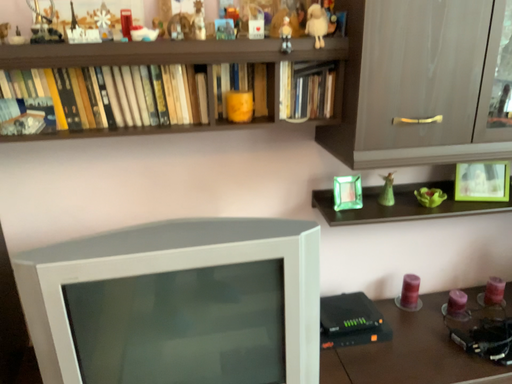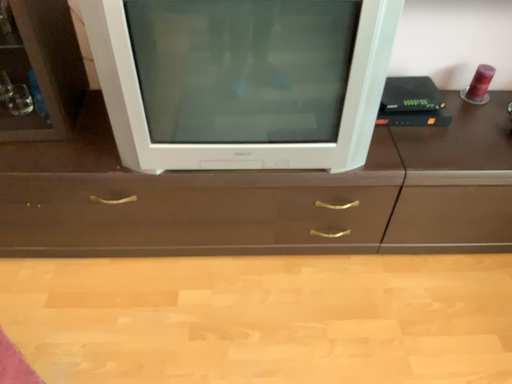
Question: Which way did the camera rotate in the video?

Choices:
 (A) rotated left
 (B) rotated right

Answer: (A)